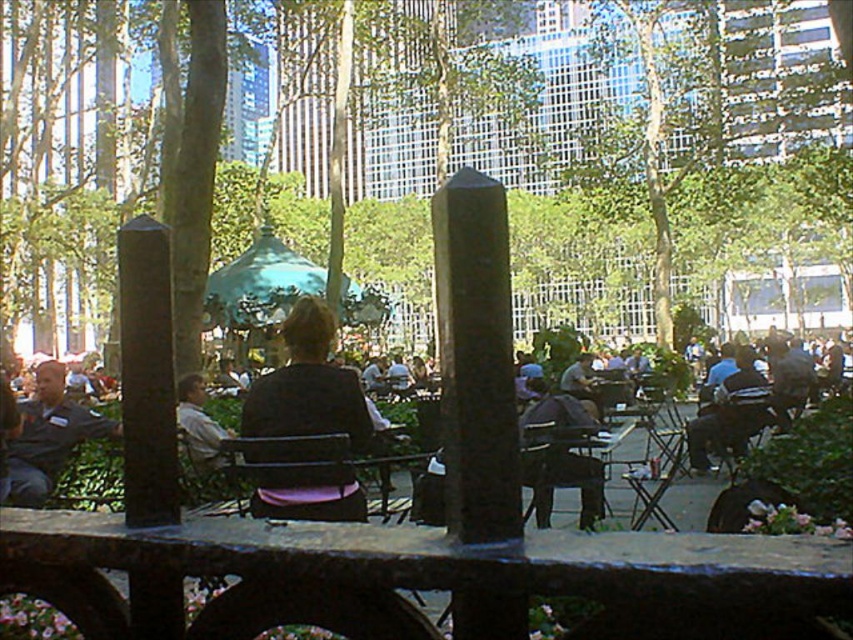
You are a delivery person carrying a large box that is 10 feet long. You need to navigate through the area between the dark brown leather jacket at center and the dark gray jacket at center. Can you pass through this space without tilting the box?

The distance between the dark brown leather jacket at center and the dark gray jacket at center is 8.22 feet. Since the box is 10 feet long, it is longer than the available space, so you cannot pass through without tilting the box.

You are standing at the edge of the park and want to take a photo of both the green leafy tree at center and the black fabric chair at center. Which object should you focus on first to ensure both are in sharp focus?

You should focus on the green leafy tree at center first because it is closer to the viewer than the black fabric chair at center, so focusing on the closer object will help both be in focus.

You are planning to set up a picnic blanket between the green leafy tree at center and the black fabric chair at center. Which object should you place the blanket closer to to ensure it fits within the available space?

The green leafy tree at center is wider than the black fabric chair at center. To ensure the picnic blanket fits within the available space, place it closer to the black fabric chair at center since it has less width compared to the tree.